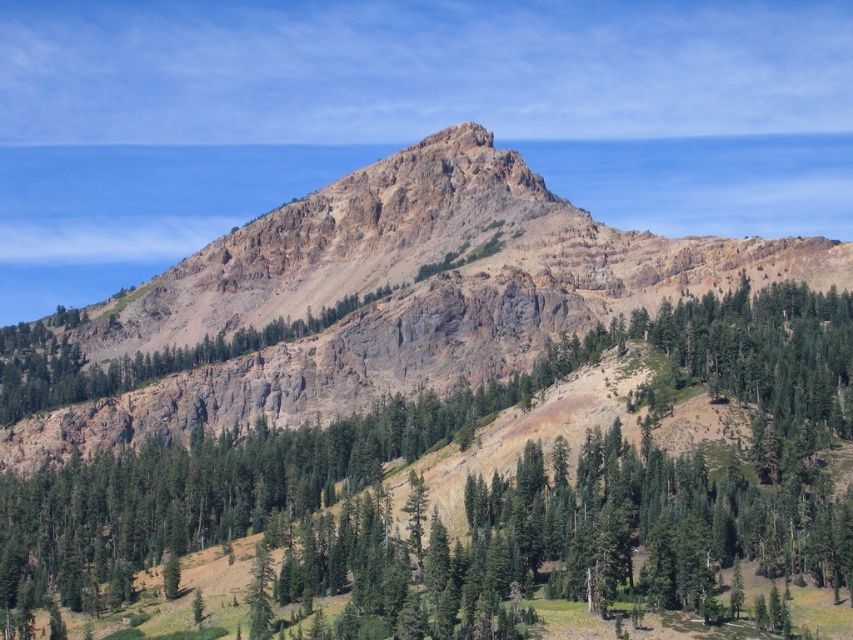
You are a hiker planning to climb the mountain and have two possible starting points marked as point (x=613, y=554) and point (x=355, y=385). Which starting point is closer to the base of the mountain where you currently stand?

Point (x=613, y=554) is closer to the viewer than point (x=355, y=385), so the starting point at point (x=613, y=554) is closer to the base of the mountain where you currently stand.

You are a hiker planning to climb the rugged rock mountain at center. You have a drone that can fly 30 meters. Can your drone reach the green textured tree at upper center from your current position at the base of the mountain?

The green textured tree at upper center and rugged rock mountain at center are 30.23 meters apart. Since the drone can only fly 30 meters, it cannot reach the tree from the base of the mountain.